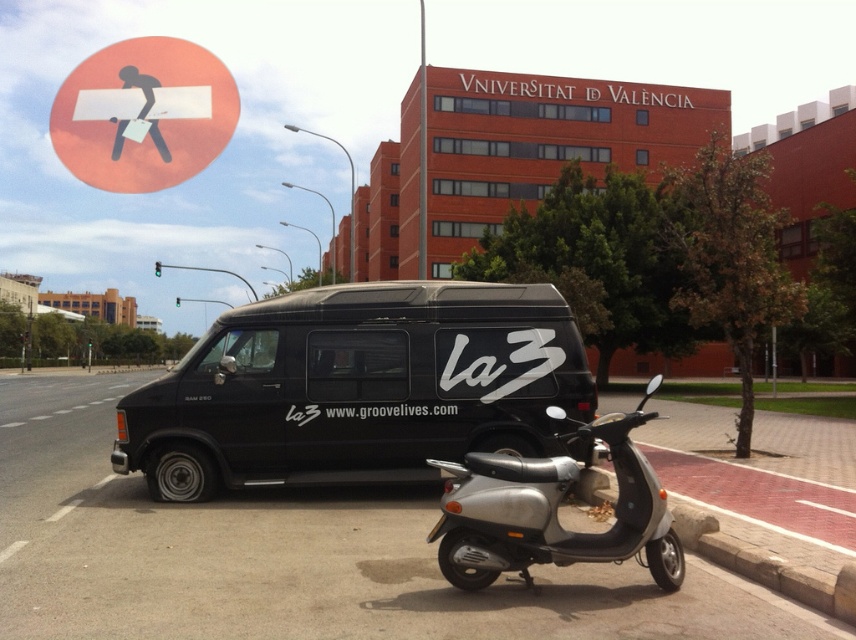
Question: From the image, what is the correct spatial relationship of black matte van at center in relation to silver metallic scooter at center?

Choices:
 (A) right
 (B) left

Answer: (B)

Question: Which object appears farthest from the camera in this image?

Choices:
 (A) orange matte sign at upper left
 (B) black matte van at center
 (C) silver metallic scooter at center

Answer: (A)

Question: Which point appears farthest from the camera in this image?

Choices:
 (A) (526, 582)
 (B) (418, 365)

Answer: (B)

Question: Which object is positioned farthest from the silver metallic scooter at center?

Choices:
 (A) orange matte sign at upper left
 (B) black matte van at center

Answer: (A)

Question: Does silver metallic scooter at center appear on the right side of orange matte sign at upper left?

Choices:
 (A) no
 (B) yes

Answer: (B)

Question: Is black matte van at center wider than orange matte sign at upper left?

Choices:
 (A) yes
 (B) no

Answer: (B)